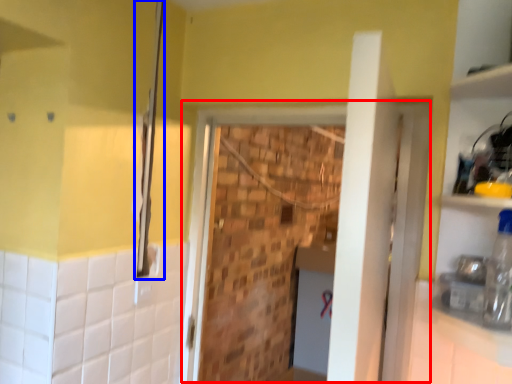
Question: Which object appears closest to the camera in this image, screen door (highlighted by a red box) or shower (highlighted by a blue box)?

Choices:
 (A) screen door
 (B) shower

Answer: (A)